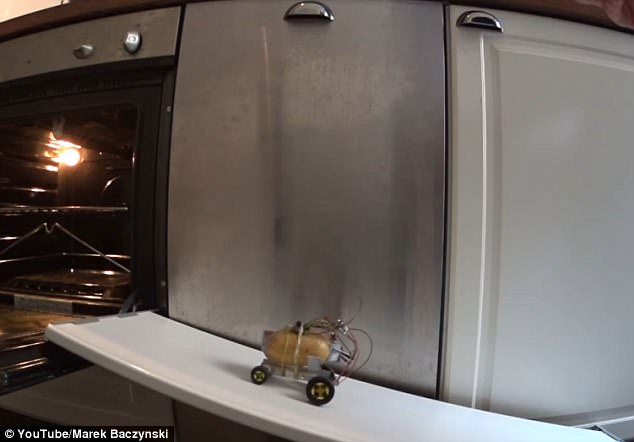
Where is `oven door`? oven door is located at coordinates (131, 37), (18, 348).